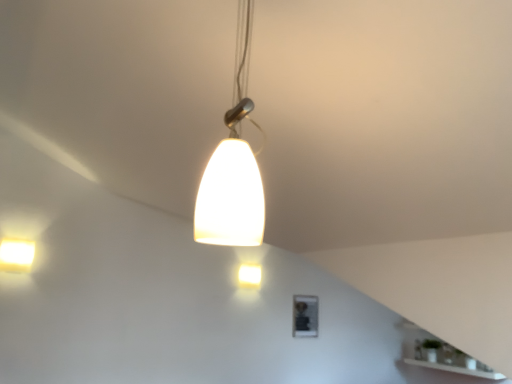
Question: Considering the relative sizes of matte white pendant light at center, arranged as the first lamp when viewed from the top, and matte white light fixture at center, acting as the 2th lamp starting from the right, in the image provided, is matte white pendant light at center, arranged as the first lamp when viewed from the top, shorter than matte white light fixture at center, acting as the 2th lamp starting from the right,?

Choices:
 (A) no
 (B) yes

Answer: (A)

Question: Does matte white pendant light at center, acting as the first lamp starting from the front, touch matte white light fixture at center, acting as the 2th lamp starting from the right?

Choices:
 (A) no
 (B) yes

Answer: (A)

Question: Is matte white pendant light at center, positioned as the 3th lamp in left-to-right order, positioned with its back to matte white light fixture at center, which is the second lamp from left to right?

Choices:
 (A) yes
 (B) no

Answer: (B)

Question: Is matte white pendant light at center, positioned as the 3th lamp in left-to-right order, wider than matte white light fixture at center, the 3th lamp viewed from the top?

Choices:
 (A) no
 (B) yes

Answer: (B)

Question: From the image's perspective, does matte white pendant light at center, the third lamp in the bottom-to-top sequence, appear lower than matte white light fixture at center, the 3th lamp viewed from the top?

Choices:
 (A) yes
 (B) no

Answer: (B)

Question: Is matte white pendant light at center, positioned as the 3th lamp in left-to-right order, at the right side of matte white light fixture at center, placed as the third lamp when sorted from front to back?

Choices:
 (A) no
 (B) yes

Answer: (B)

Question: Can you confirm if matte white light fixture at upper left, acting as the second lamp starting from the front, is shorter than matte white pendant light at center, positioned as the 3th lamp in left-to-right order?

Choices:
 (A) yes
 (B) no

Answer: (A)

Question: Is the position of matte white light fixture at upper left, positioned as the first lamp in left-to-right order, more distant than that of matte white pendant light at center, placed as the first lamp when sorted from right to left?

Choices:
 (A) yes
 (B) no

Answer: (A)

Question: Is matte white light fixture at upper left, acting as the second lamp starting from the front, completely or partially outside of matte white pendant light at center, the third lamp in the bottom-to-top sequence?

Choices:
 (A) no
 (B) yes

Answer: (B)

Question: Is matte white light fixture at upper left, acting as the second lamp starting from the front, not close to matte white pendant light at center, which is the 3th lamp from back to front?

Choices:
 (A) yes
 (B) no

Answer: (A)

Question: From the image's perspective, is matte white light fixture at upper left, placed as the 2th lamp when sorted from back to front, on top of matte white pendant light at center, acting as the first lamp starting from the front?

Choices:
 (A) no
 (B) yes

Answer: (A)

Question: From a real-world perspective, does matte white light fixture at upper left, the 3th lamp viewed from the right, stand above matte white pendant light at center, which is the 3th lamp from back to front?

Choices:
 (A) no
 (B) yes

Answer: (A)

Question: Considering the relative sizes of matte white light fixture at center, acting as the 2th lamp starting from the right, and matte white light fixture at upper left, marked as the 2th lamp in a top-to-bottom arrangement, in the image provided, is matte white light fixture at center, acting as the 2th lamp starting from the right, shorter than matte white light fixture at upper left, marked as the 2th lamp in a top-to-bottom arrangement,?

Choices:
 (A) no
 (B) yes

Answer: (B)